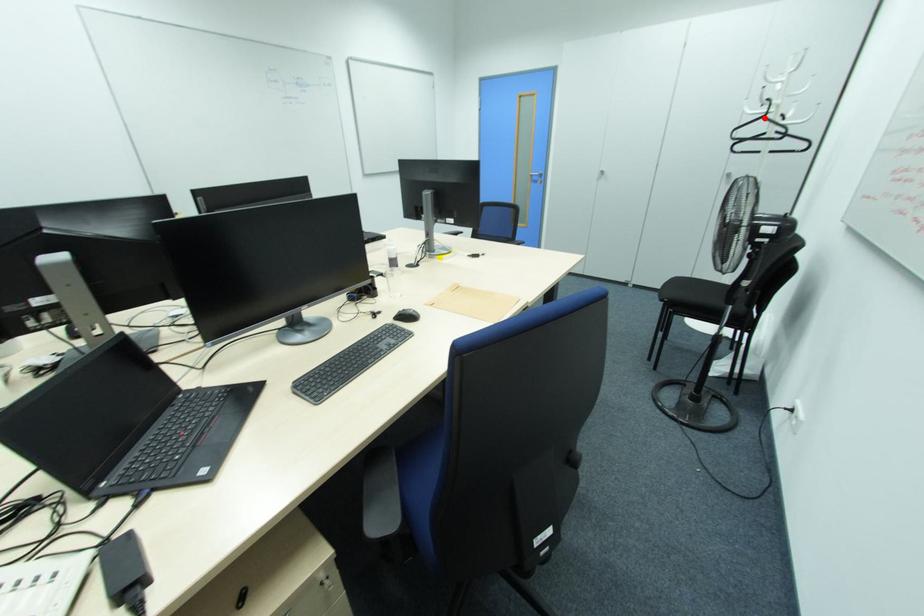
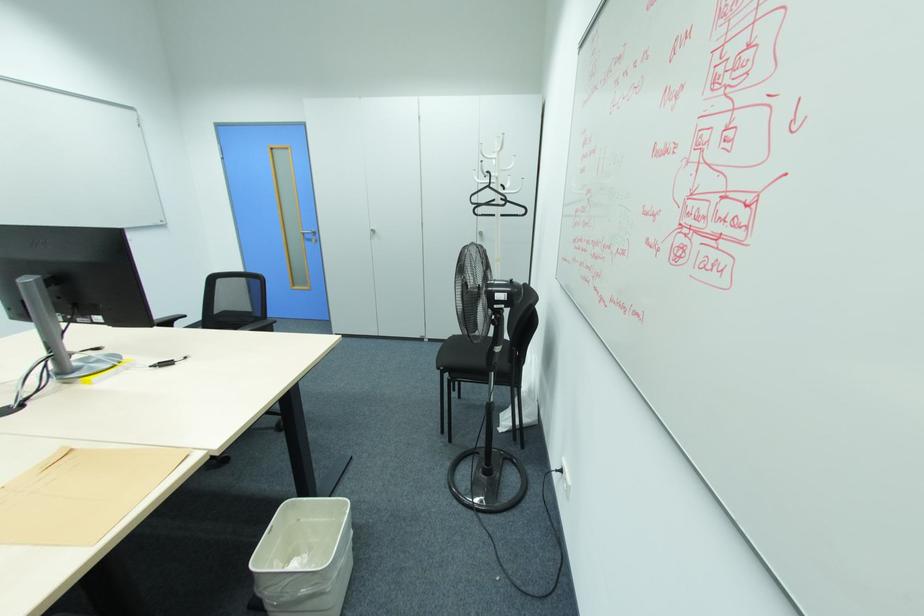
Question: I am providing you with two images of the same scene from different viewpoints. Image1 has a red point marked. In image2, the corresponding 3D location appears at what relative position? Reply with the corresponding letter.

Choices:
 (A) Closer
 (B) Farther

Answer: (A)